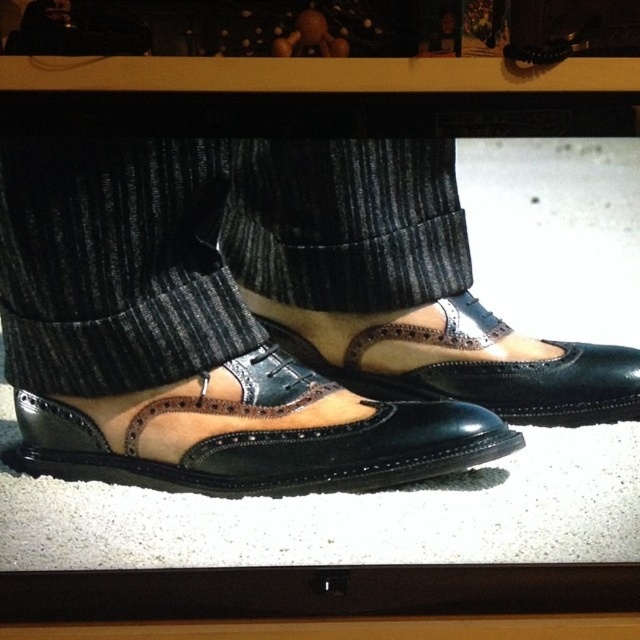
Does suede leather shoes at center lie in front of suede/leather wingtip shoe at center?

Yes, suede leather shoes at center is closer to the viewer.

Measure the distance between point (164,406) and camera.

Point (164,406) is 1.20 meters away from camera.

Is point (243, 321) positioned in front of point (502, 403)?

No, (243, 321) is further to viewer.

Locate an element on the screen. suede leather shoes at center is located at coordinates (264, 317).

Can you confirm if suede leather shoes at center is thinner than suede/black shoe at center?

No.

Is suede leather shoes at center positioned before suede/black shoe at center?

That is True.

Which is in front, point (212, 360) or point (481, 442)?

Positioned in front is point (481, 442).

The image size is (640, 640). In order to click on suede leather shoes at center in this screenshot , I will do `click(264, 317)`.

Who is taller, suede/black shoe at center or suede/leather wingtip shoe at center?

Standing taller between the two is suede/black shoe at center.

Is suede/black shoe at center above suede/leather wingtip shoe at center?

Actually, suede/black shoe at center is below suede/leather wingtip shoe at center.

Is point (476, 449) positioned in front of point (316, 314)?

Yes, point (476, 449) is closer to viewer.

Where is `suede/black shoe at center`? The image size is (640, 640). suede/black shoe at center is located at coordinates (256, 433).